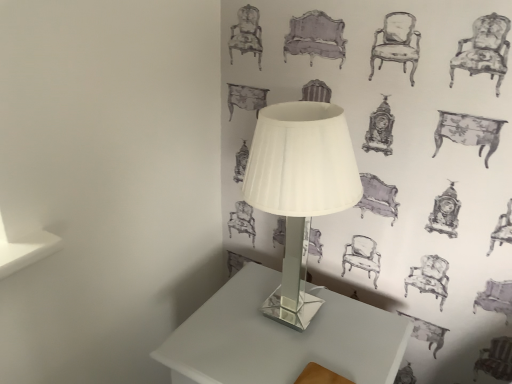
The image size is (512, 384). I want to click on unoccupied region to the right of white glass lamp at center, so click(x=370, y=332).